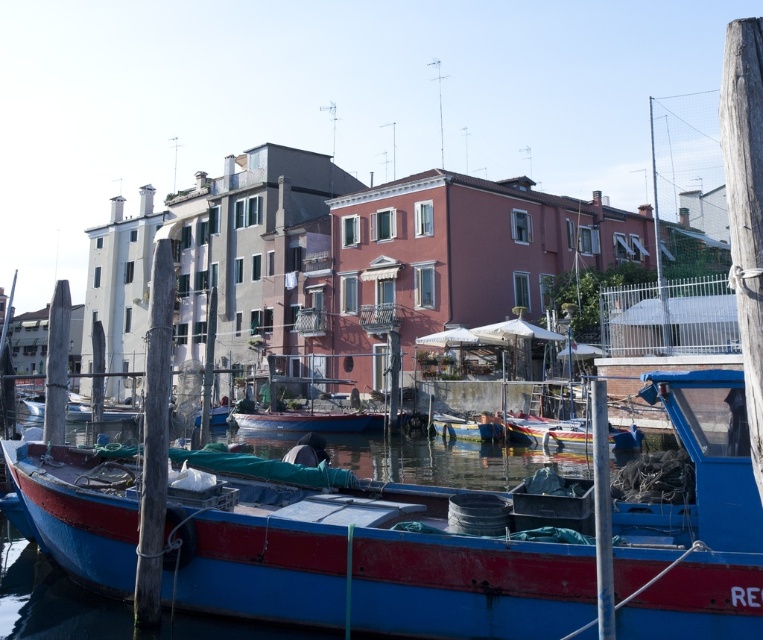
Based on the photo, you are a photographer planning to take a photo of the waterfront scene. You want to ensure that both the blue matte boat at lower left and the blue glossy boat at center are clearly visible in your shot. Given their heights, which boat will appear larger in the photograph?

The blue matte boat at lower left will appear larger in the photograph because it has a greater height compared to the blue glossy boat at center.

You are standing at the edge of the wooden pier looking towards the fishing boat. There are two points marked on the boat deck. One is at coordinate point [208,579] and the other at point [351,426]. Which point is closer to you?

Point [208,579] is closer to the camera than point [351,426].

Based on the photo, you are a marine biologist planning to board a boat for a research trip. You need a boat that can accommodate your equipment. Given the scene described, which boat between the blue matte boat at lower left and the blue glossy boat at center would you choose and why?

The blue matte boat at lower left has a larger width than the blue glossy boat at center, so it can accommodate more equipment. Therefore, you should choose the blue matte boat at lower left.